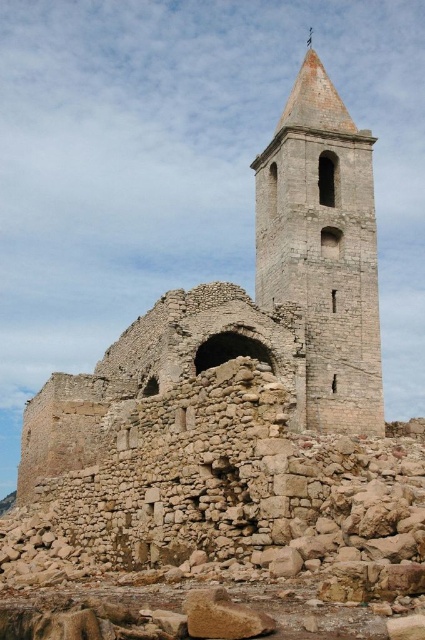
Can you confirm if rustic stone ruins at center is positioned to the right of stone bell tower at center?

Incorrect, rustic stone ruins at center is not on the right side of stone bell tower at center.

The width and height of the screenshot is (425, 640). What do you see at coordinates (254, 300) in the screenshot?
I see `rustic stone ruins at center` at bounding box center [254, 300].

You are a GUI agent. You are given a task and a screenshot of the screen. Output one action in this format:
    pyautogui.click(x=<x>, y=<y>)
    Task: Click on the rustic stone ruins at center
    
    Given the screenshot: What is the action you would take?
    pyautogui.click(x=254, y=300)